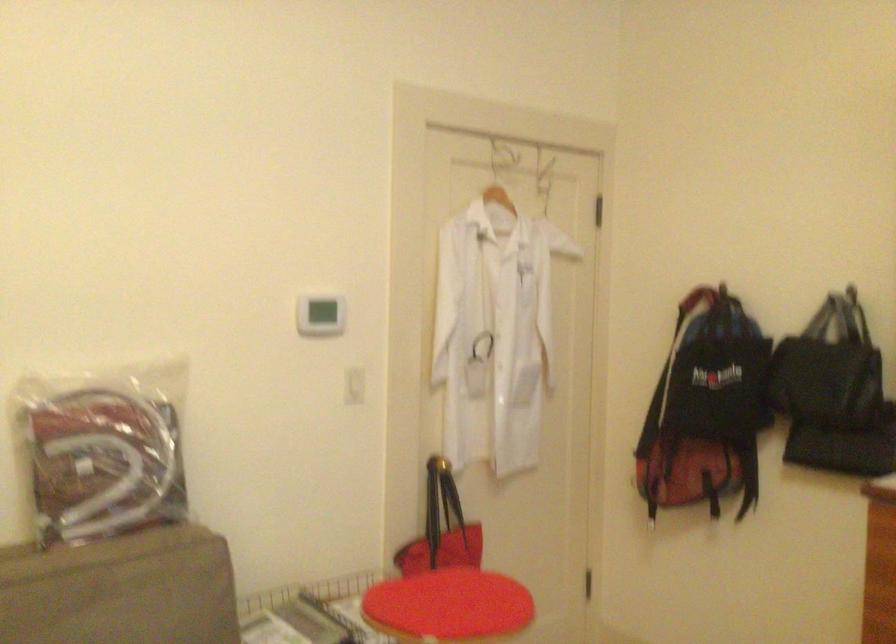
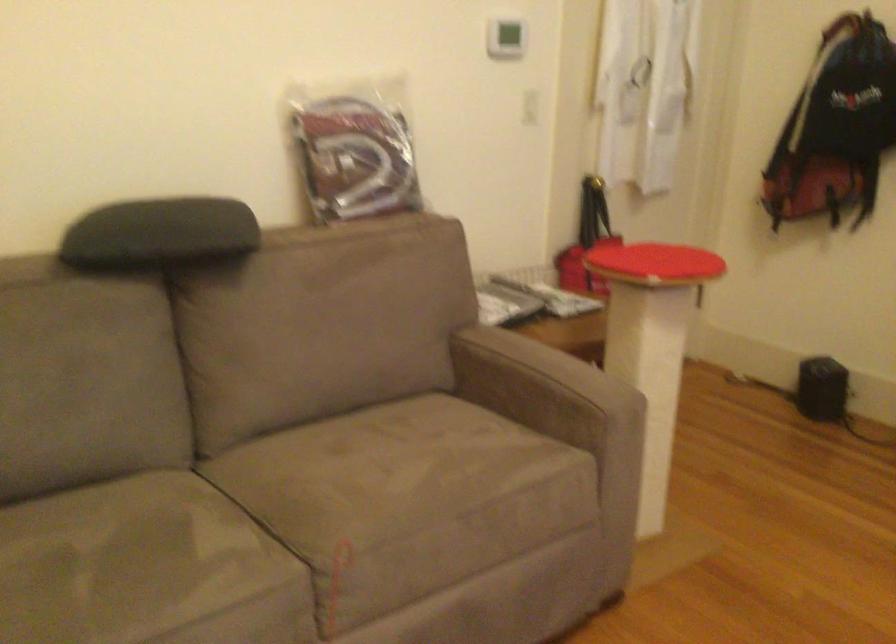
Where in the second image is the point corresponding to pixel 104 456 from the first image?

(354, 149)